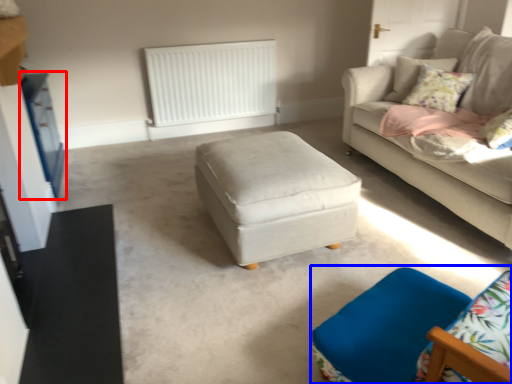
Question: Which point is further to the camera, dresser (highlighted by a red box) or swivel chair (highlighted by a blue box)?

Choices:
 (A) dresser
 (B) swivel chair

Answer: (A)